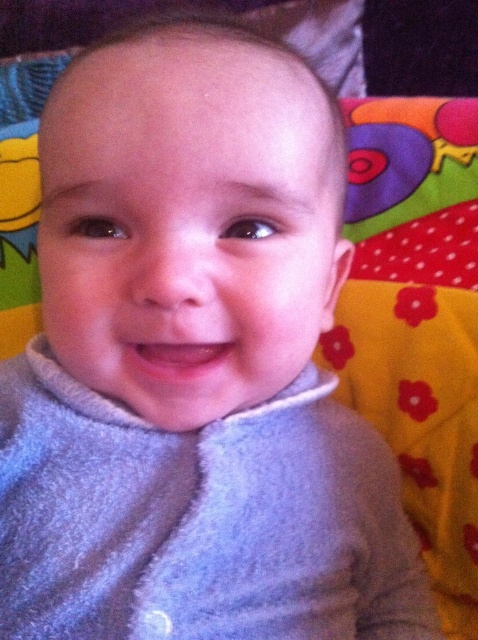
Question: Observing the image, what is the correct spatial positioning of gray soft baby at center in reference to gray fleece sweater at center?

Choices:
 (A) right
 (B) left

Answer: (B)

Question: Does gray soft baby at center appear over gray fleece sweater at center?

Choices:
 (A) no
 (B) yes

Answer: (B)

Question: Among these objects, which one is nearest to the camera?

Choices:
 (A) gray soft baby at center
 (B) gray fleece sweater at center

Answer: (A)

Question: Which point appears farthest from the camera in this image?

Choices:
 (A) (57, 168)
 (B) (69, 506)

Answer: (B)

Question: Can you confirm if gray soft baby at center is thinner than gray fleece sweater at center?

Choices:
 (A) yes
 (B) no

Answer: (A)